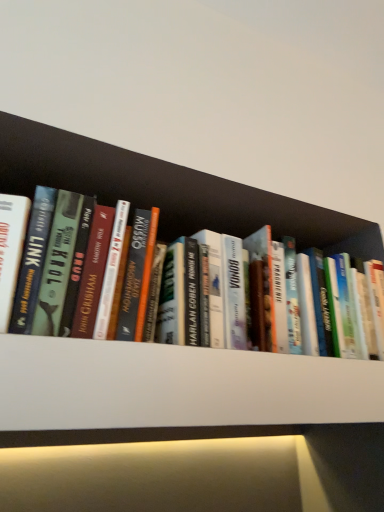
Question: Does hardcover book at center lie behind white matte shelf at center?

Choices:
 (A) yes
 (B) no

Answer: (A)

Question: Can you confirm if hardcover book at center is bigger than white matte shelf at center?

Choices:
 (A) yes
 (B) no

Answer: (A)

Question: Is hardcover book at center completely or partially outside of white matte shelf at center?

Choices:
 (A) yes
 (B) no

Answer: (A)

Question: Is hardcover book at center at the right side of white matte shelf at center?

Choices:
 (A) no
 (B) yes

Answer: (B)

Question: From the image's perspective, is hardcover book at center on white matte shelf at center?

Choices:
 (A) no
 (B) yes

Answer: (B)

Question: Is hardcover book at center positioned with its back to white matte shelf at center?

Choices:
 (A) no
 (B) yes

Answer: (A)

Question: Does white matte shelf at center come in front of hardcover book at center?

Choices:
 (A) no
 (B) yes

Answer: (B)

Question: From a real-world perspective, is white matte shelf at center physically below hardcover book at center?

Choices:
 (A) no
 (B) yes

Answer: (B)

Question: From a real-world perspective, is white matte shelf at center physically above hardcover book at center?

Choices:
 (A) yes
 (B) no

Answer: (B)

Question: Is hardcover book at center inside white matte shelf at center?

Choices:
 (A) no
 (B) yes

Answer: (A)

Question: Can you confirm if white matte shelf at center is thinner than hardcover book at center?

Choices:
 (A) no
 (B) yes

Answer: (A)

Question: Does white matte shelf at center lie behind hardcover book at center?

Choices:
 (A) yes
 (B) no

Answer: (B)

Question: Considering the positions of hardcover book at center and white matte shelf at center in the image, is hardcover book at center wider or thinner than white matte shelf at center?

Choices:
 (A) thin
 (B) wide

Answer: (A)